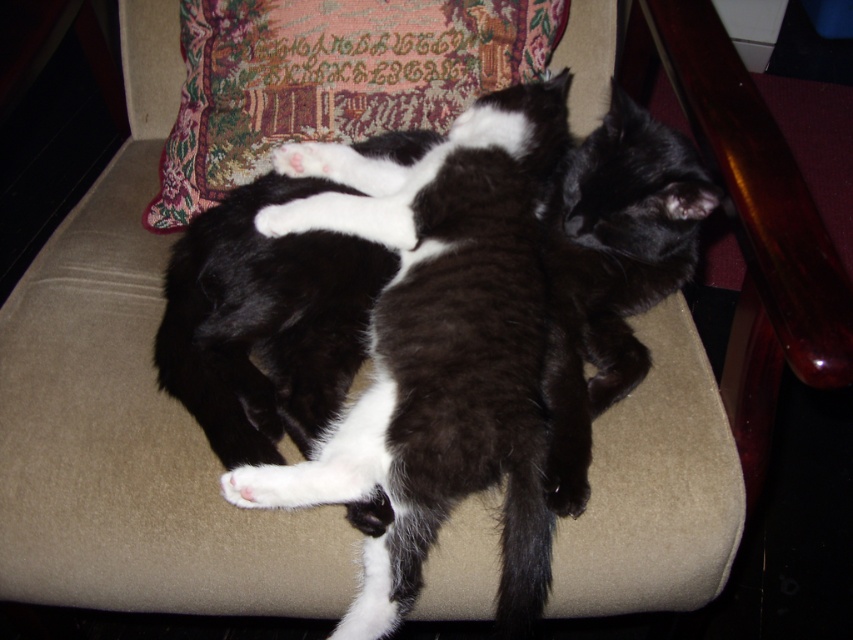
Question: Can you confirm if soft fur cat at center is wider than velvet cushion at upper center?

Choices:
 (A) no
 (B) yes

Answer: (A)

Question: Which object is farther from the camera taking this photo?

Choices:
 (A) velvet cushion at upper center
 (B) soft fur cat at center

Answer: (A)

Question: Where is soft fur cat at center located in relation to velvet cushion at upper center in the image?

Choices:
 (A) below
 (B) above

Answer: (A)

Question: Is soft fur cat at center to the right of velvet cushion at upper center from the viewer's perspective?

Choices:
 (A) yes
 (B) no

Answer: (A)